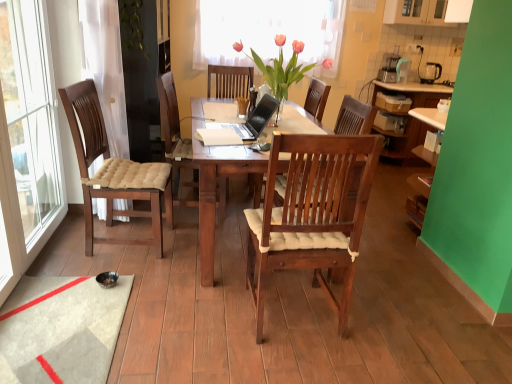
Question: Is white plastic power outlet at upper right bigger or smaller than translucent fabric at upper center?

Choices:
 (A) big
 (B) small

Answer: (B)

Question: Is white plastic power outlet at upper right wider or thinner than translucent fabric at upper center?

Choices:
 (A) wide
 (B) thin

Answer: (B)

Question: Estimate the real-world distances between objects in this image. Which object is closer to the white plastic power outlet at upper right?

Choices:
 (A) black plastic kettle at upper right
 (B) translucent fabric at upper center
 (C) wooden chair at center
 (D) satin black laptop at center
 (E) green leafy plant at upper left

Answer: (A)

Question: Based on their relative distances, which object is farther from the pink matte vase at center?

Choices:
 (A) satin black laptop at center
 (B) wooden chair at center
 (C) green leafy plant at upper left
 (D) white plastic power outlet at upper right
 (E) black plastic kettle at upper right

Answer: (D)